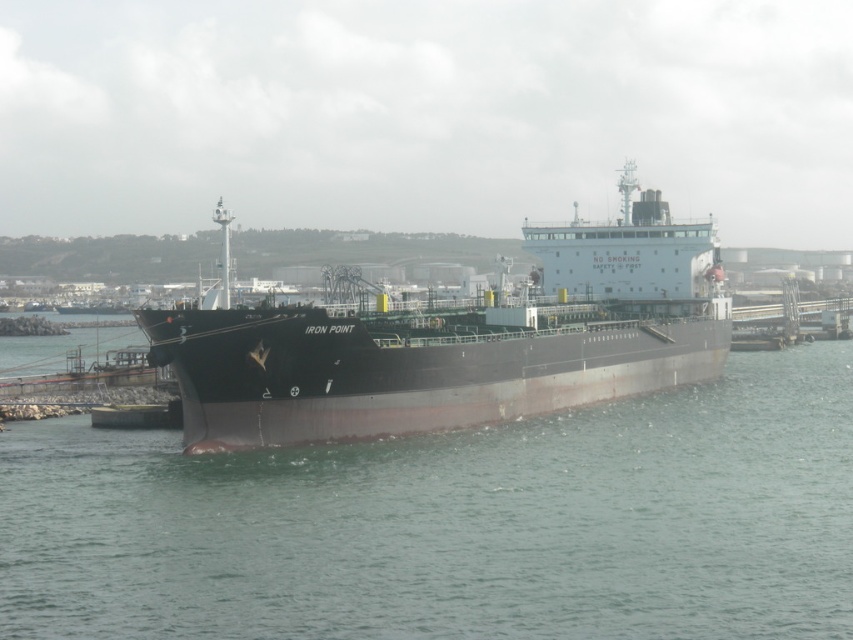
Question: Which point appears farthest from the camera in this image?

Choices:
 (A) (59, 483)
 (B) (242, 372)

Answer: (B)

Question: Is green matte water at center in front of black matte ship at center?

Choices:
 (A) no
 (B) yes

Answer: (B)

Question: Does green matte water at center appear under black matte ship at center?

Choices:
 (A) yes
 (B) no

Answer: (A)

Question: Which object appears closest to the camera in this image?

Choices:
 (A) black matte ship at center
 (B) green matte water at center

Answer: (B)

Question: Does green matte water at center have a smaller size compared to black matte ship at center?

Choices:
 (A) no
 (B) yes

Answer: (B)